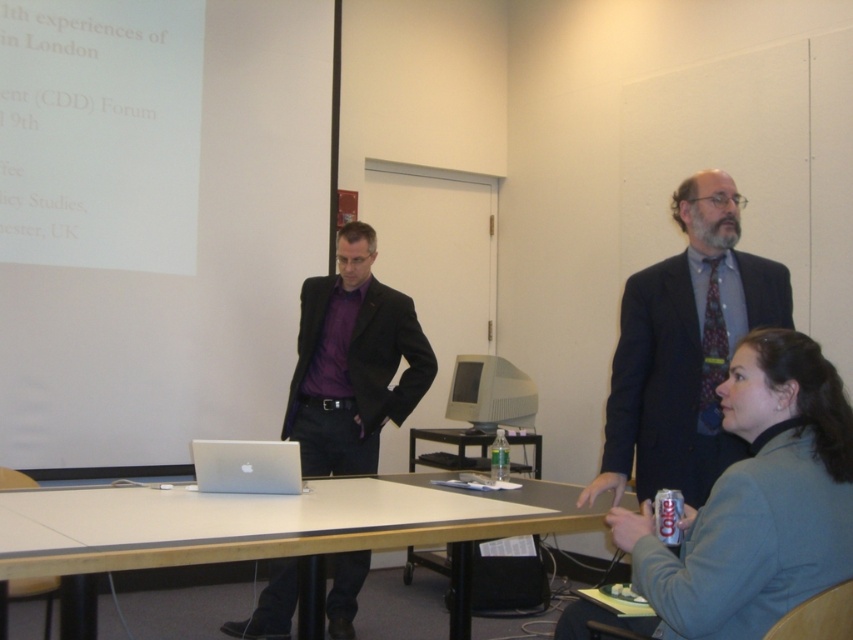
Question: Does gray woolen blazer at lower right lie behind silver metallic laptop at center?

Choices:
 (A) yes
 (B) no

Answer: (B)

Question: Which point is farther from the camera taking this photo?

Choices:
 (A) (634, 371)
 (B) (283, 500)
 (C) (392, 298)

Answer: (C)

Question: Which object appears closest to the camera in this image?

Choices:
 (A) matte black suit at center
 (B) dark blue suit at right
 (C) gray woolen blazer at lower right

Answer: (C)

Question: Can you confirm if light brown wooden table at center is bigger than matte black suit at center?

Choices:
 (A) no
 (B) yes

Answer: (B)

Question: Which of the following is the closest to the observer?

Choices:
 (A) silver metallic laptop at center
 (B) light brown wooden table at center
 (C) matte black suit at center
 (D) dark blue suit at right

Answer: (B)

Question: Is matte black suit at center to the left of dark blue suit at right from the viewer's perspective?

Choices:
 (A) no
 (B) yes

Answer: (B)